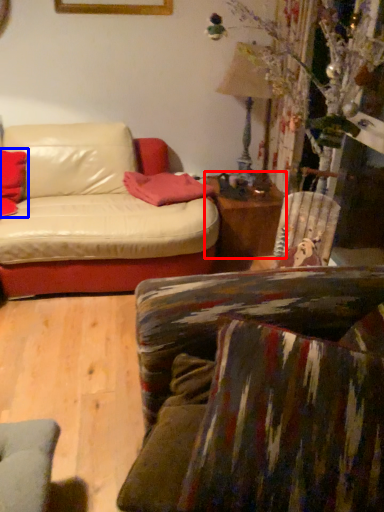
Question: Among these objects, which one is nearest to the camera, table (highlighted by a red box) or pillow (highlighted by a blue box)?

Choices:
 (A) table
 (B) pillow

Answer: (B)